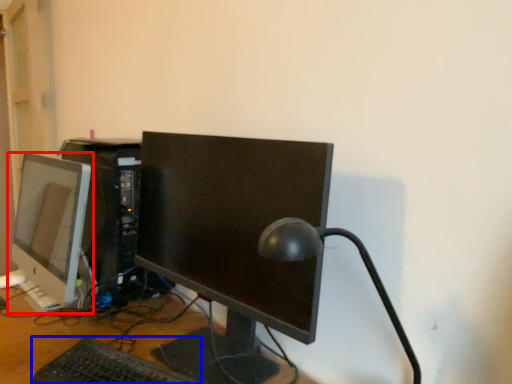
Question: Which object is closer to the camera taking this photo, computer monitor (highlighted by a red box) or computer keyboard (highlighted by a blue box)?

Choices:
 (A) computer monitor
 (B) computer keyboard

Answer: (B)